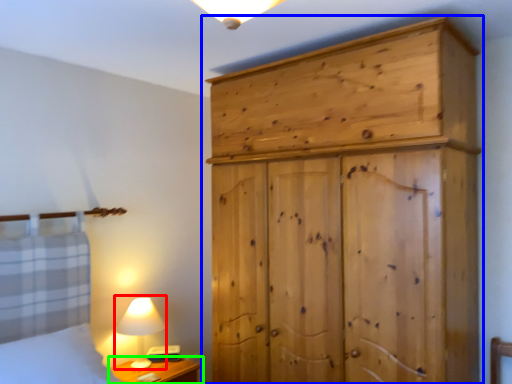
Question: Which object is positioned closest to table lamp (highlighted by a red box)? Select from cupboard (highlighted by a blue box) and nightstand (highlighted by a green box).

Choices:
 (A) cupboard
 (B) nightstand

Answer: (B)